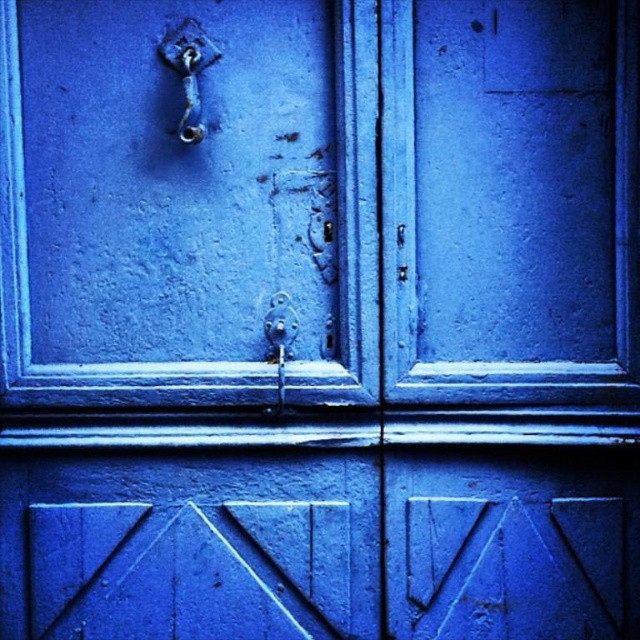
You are standing in front of the weathered blue door and need to hang a small bag. The bag has a hook that needs to be attached to the door. Which object on the door is closer to you, the matte blue door handle at upper left or the polished brass hook at upper left, so you can decide where to hang it?

The matte blue door handle at upper left is closer to you than the polished brass hook at upper left, so you should hang the bag on the matte blue door handle at upper left.

You are a painter who needs to hang a small decorative hook on the blue door. The hook you have is exactly the same size as the polished brass hook at upper left. If you want to place your new hook below the existing matte blue door handle at upper left, will there be enough vertical space between them?

The matte blue door handle at upper left is taller than the polished brass hook at upper left. Since the handle is taller, there is sufficient vertical space to place the new hook below it without overlapping.